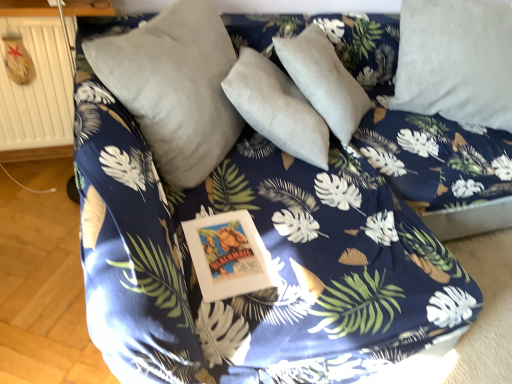
Question: Is beige wooden radiator at left not near satin gray pillow at center, the 2th pillow from the right?

Choices:
 (A) no
 (B) yes

Answer: (A)

Question: Is beige wooden radiator at left outside satin gray pillow at center, the 2th pillow from the right?

Choices:
 (A) no
 (B) yes

Answer: (B)

Question: Considering the relative sizes of beige wooden radiator at left and satin gray pillow at center, which is the 1th pillow from left to right, in the image provided, is beige wooden radiator at left thinner than satin gray pillow at center, which is the 1th pillow from left to right,?

Choices:
 (A) yes
 (B) no

Answer: (A)

Question: From the image's perspective, is beige wooden radiator at left under satin gray pillow at center, the 2th pillow from the right?

Choices:
 (A) yes
 (B) no

Answer: (B)

Question: Is beige wooden radiator at left at the left side of satin gray pillow at center, the 2th pillow from the right?

Choices:
 (A) yes
 (B) no

Answer: (A)

Question: In the image, is beige wooden radiator at left positioned in front of or behind white soft pillow at upper right, positioned as the first pillow in right-to-left order?

Choices:
 (A) behind
 (B) front

Answer: (B)

Question: Is beige wooden radiator at left inside the boundaries of white soft pillow at upper right, which is the second pillow from left to right, or outside?

Choices:
 (A) outside
 (B) inside

Answer: (A)

Question: Considering the positions of beige wooden radiator at left and white soft pillow at upper right, which is the second pillow from left to right, in the image, is beige wooden radiator at left wider or thinner than white soft pillow at upper right, which is the second pillow from left to right,?

Choices:
 (A) wide
 (B) thin

Answer: (B)

Question: Is beige wooden radiator at left taller or shorter than white soft pillow at upper right, which is the second pillow from left to right?

Choices:
 (A) short
 (B) tall

Answer: (A)

Question: In terms of size, does white soft pillow at upper right, which is the second pillow from left to right, appear bigger or smaller than beige wooden radiator at left?

Choices:
 (A) small
 (B) big

Answer: (B)

Question: In terms of height, does white soft pillow at upper right, positioned as the first pillow in right-to-left order, look taller or shorter compared to beige wooden radiator at left?

Choices:
 (A) short
 (B) tall

Answer: (B)

Question: Is white soft pillow at upper right, which is the second pillow from left to right, in front of or behind beige wooden radiator at left in the image?

Choices:
 (A) behind
 (B) front

Answer: (A)

Question: Choose the correct answer: Is white soft pillow at upper right, positioned as the first pillow in right-to-left order, inside beige wooden radiator at left or outside it?

Choices:
 (A) outside
 (B) inside

Answer: (A)

Question: Is satin gray pillow at center, the 2th pillow from the right, inside the boundaries of beige wooden radiator at left, or outside?

Choices:
 (A) outside
 (B) inside

Answer: (A)

Question: In the image, is satin gray pillow at center, which is the 1th pillow from left to right, positioned in front of or behind beige wooden radiator at left?

Choices:
 (A) behind
 (B) front

Answer: (B)